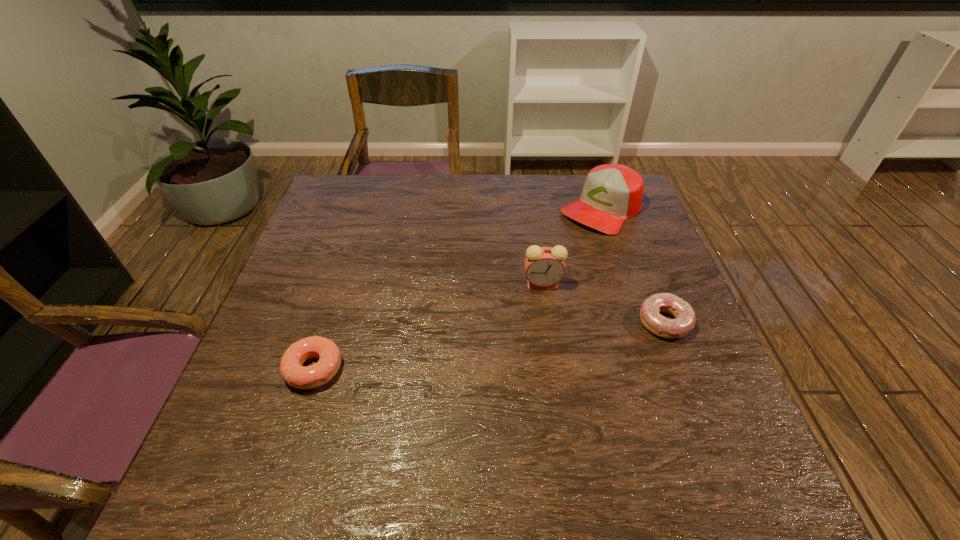
Find the location of a particular element. This screenshot has width=960, height=540. empty location between the leftmost object and the second farthest object is located at coordinates (428, 326).

I want to click on free spot between the farthest object and the nearer doughnut, so click(x=458, y=289).

The height and width of the screenshot is (540, 960). In order to click on vacant space that's between the farther doughnut and the left doughnut in this screenshot , I will do `click(490, 346)`.

Locate an element on the screen. This screenshot has width=960, height=540. free space between the leftmost object and the second nearest object is located at coordinates click(490, 346).

Where is `free space that is in between the second farthest object and the right doughnut`? free space that is in between the second farthest object and the right doughnut is located at coordinates (604, 302).

The width and height of the screenshot is (960, 540). Find the location of `free area in between the baseball cap and the right doughnut`. free area in between the baseball cap and the right doughnut is located at coordinates (634, 266).

Identify which object is the nearest to the farthest object. Please provide its 2D coordinates. Your answer should be formatted as a tuple, i.e. [(x, y)], where the tuple contains the x and y coordinates of a point satisfying the conditions above.

[(544, 266)]

The image size is (960, 540). Find the location of `the third closest object to the left doughnut`. the third closest object to the left doughnut is located at coordinates (612, 193).

Image resolution: width=960 pixels, height=540 pixels. I want to click on blank space that satisfies the following two spatial constraints: 1. on the front side of the third farthest object; 2. on the left side of the third object from right to left, so click(548, 322).